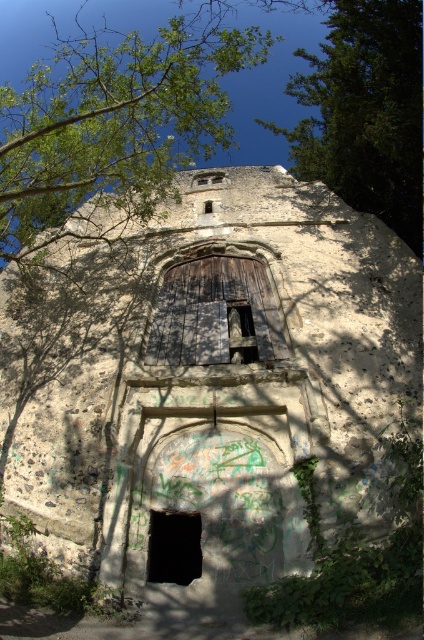
Question: Does green leafy tree at upper left have a larger size compared to wooden door at center?

Choices:
 (A) no
 (B) yes

Answer: (B)

Question: Does green leafy tree at upper right have a greater width compared to wooden door at center?

Choices:
 (A) yes
 (B) no

Answer: (A)

Question: Among these objects, which one is farthest from the camera?

Choices:
 (A) green leafy tree at upper left
 (B) green leafy tree at upper right

Answer: (B)

Question: Which point is closer to the camera?

Choices:
 (A) green leafy tree at upper right
 (B) wooden door at center

Answer: (A)

Question: Among these objects, which one is nearest to the camera?

Choices:
 (A) green leafy tree at upper right
 (B) green leafy tree at upper left

Answer: (B)

Question: Is green leafy tree at upper left to the right of black matte window at lower center from the viewer's perspective?

Choices:
 (A) no
 (B) yes

Answer: (A)